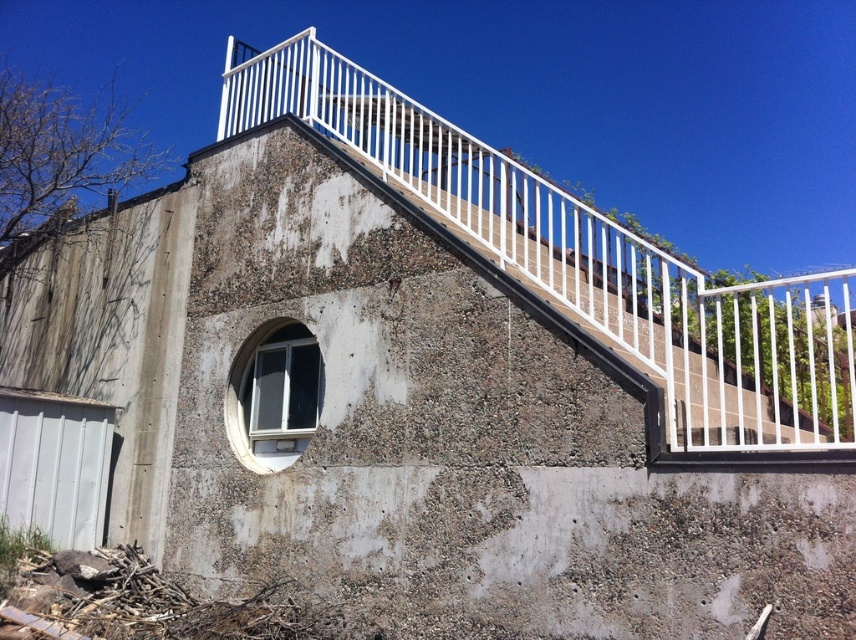
You are an architect designing a new building and want to ensure that the white metal railing at upper center and the clear glass window at center are proportionate. Based on the scene, which object is smaller and needs to be adjusted for balance?

The white metal railing at upper center is smaller than the clear glass window at center, so it needs to be adjusted to achieve balance.

You are standing in front of the building and want to locate the white metal railing at upper center. According to the coordinates provided, where exactly is it positioned?

The white metal railing at upper center is located at point coordinates of 0.408 on the x axis and 0.687 on the y axis.